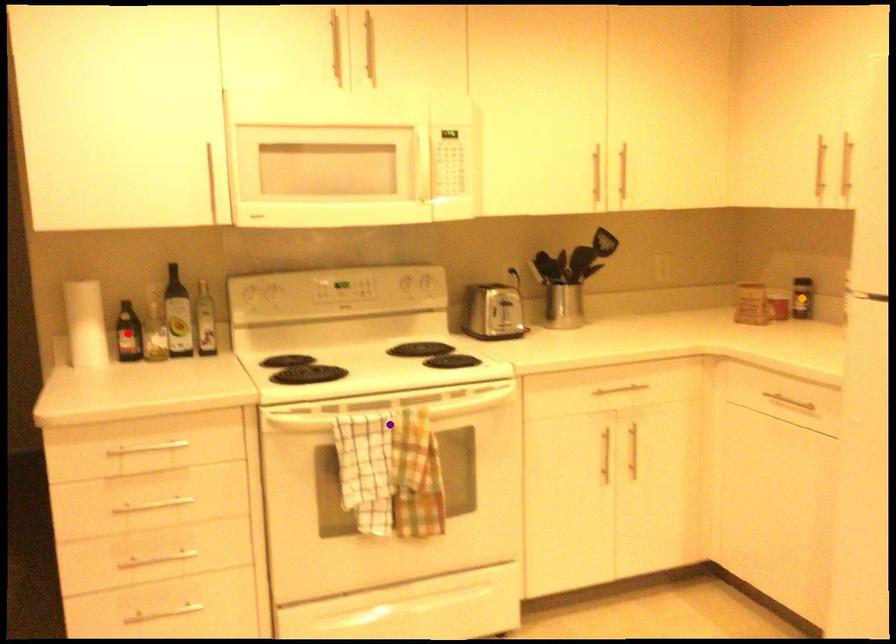
Based on the photo, order these from nearest to farthest:
- purple point
- orange point
- red point

purple point, red point, orange point